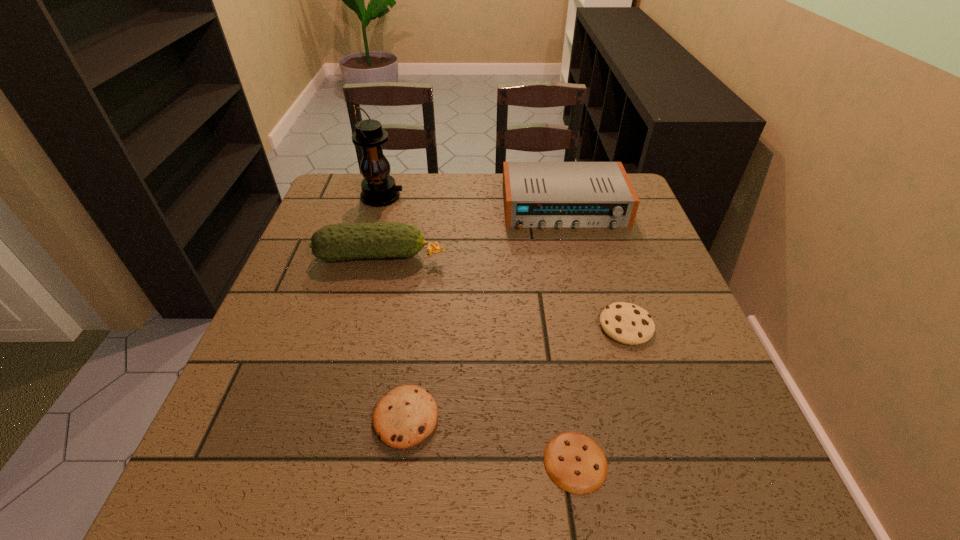
At what (x,y) coordinates should I click in order to perform the action: click on free space located at the blossom end of the cucumber. Please return your answer as a coordinate pair (x, y). Looking at the image, I should click on (598, 257).

What are the coordinates of `blank space located on the front panel of the radio receiver` in the screenshot? It's located at coord(574,251).

Where is `vacant space located 0.130m on the left of the rightmost cookie`? vacant space located 0.130m on the left of the rightmost cookie is located at coordinates (538, 326).

The width and height of the screenshot is (960, 540). I want to click on free space located 0.340m on the back of the second tallest cookie, so click(426, 267).

Find the location of a particular element. vacant space located on the left of the shortest object is located at coordinates (384, 462).

Image resolution: width=960 pixels, height=540 pixels. In order to click on lantern present at the far edge in this screenshot , I will do `click(379, 189)`.

Locate an element on the screen. This screenshot has height=540, width=960. radio receiver located at the far edge is located at coordinates (536, 194).

At what (x,y) coordinates should I click in order to perform the action: click on object that is positioned at the near edge. Please return your answer as a coordinate pair (x, y). Looking at the image, I should click on click(x=574, y=462).

Identify the location of lantern situated at the left edge. This screenshot has width=960, height=540. (379, 189).

Identify the location of cucumber at the left edge. (336, 242).